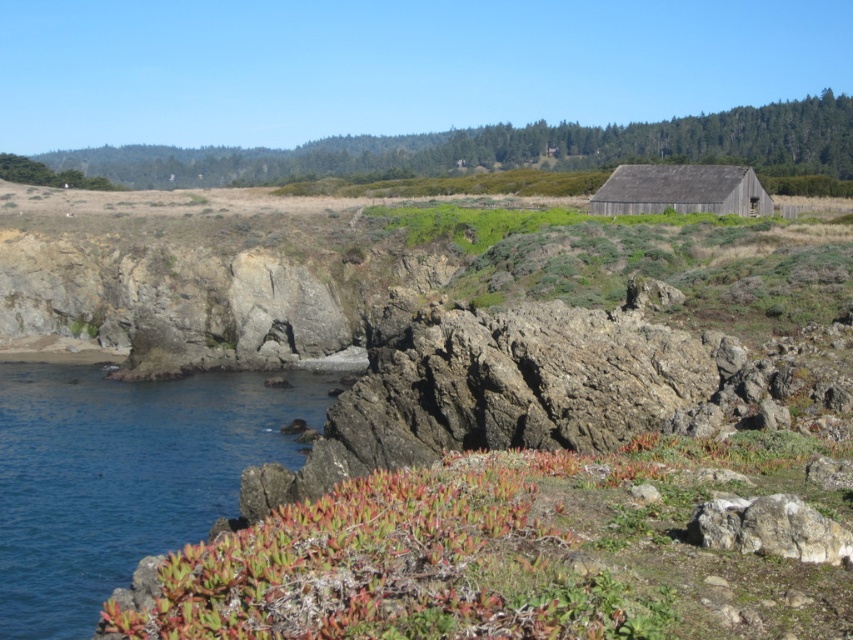
You are standing on the rocky terrain and see the green succulent at lower center and the blue water at lower left. Which object is closer to your current position?

The green succulent at lower center is closer to your current position because it is positioned over the blue water at lower left, indicating it is in front of the water.

Consider the image. You are standing at the camera position looking at the coastal landscape. There are two points marked in the scene. The first point is at coordinate point (608, 497) and the second is at point (49, 582). Which of these two points is physically closer to your current position?

Point (608, 497) is closer to the camera than point (49, 582), so the first point is physically closer to your current position.